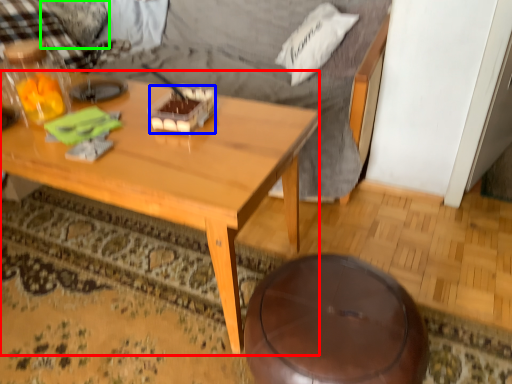
Question: Which object is the farthest from coffee table (highlighted by a red box)? Choose among these: food (highlighted by a blue box) or pillow (highlighted by a green box).

Choices:
 (A) food
 (B) pillow

Answer: (B)